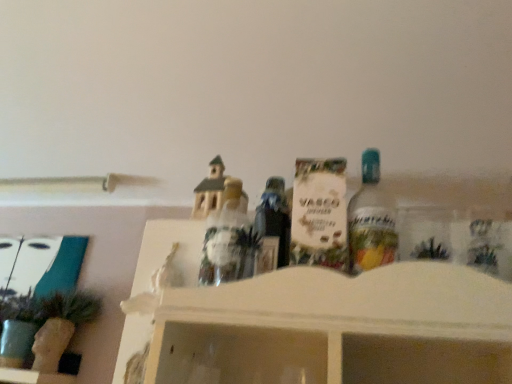
Question: Can you confirm if white matte box at center, placed as the third toy when sorted from left to right, is positioned to the right of matte brown house at center, the second toy positioned from the left?

Choices:
 (A) yes
 (B) no

Answer: (A)

Question: Is white matte box at center, placed as the third toy when sorted from left to right, with matte brown house at center, the 2th toy positioned from the right?

Choices:
 (A) yes
 (B) no

Answer: (B)

Question: Can you confirm if white matte box at center, arranged as the first toy when viewed from the right, is wider than matte brown house at center, the second toy positioned from the left?

Choices:
 (A) no
 (B) yes

Answer: (A)

Question: Can you confirm if white matte box at center, placed as the third toy when sorted from left to right, is bigger than matte brown house at center, the second toy positioned from the left?

Choices:
 (A) no
 (B) yes

Answer: (A)

Question: Is white matte box at center, placed as the third toy when sorted from left to right, facing away from matte brown house at center, the second toy positioned from the left?

Choices:
 (A) no
 (B) yes

Answer: (A)

Question: From the image's perspective, is white matte box at center, arranged as the first toy when viewed from the right, below matte brown house at center, the second toy positioned from the left?

Choices:
 (A) yes
 (B) no

Answer: (B)

Question: From a real-world perspective, is translucent plastic figurine at center, the third toy from the right, located beneath clear glass bottle at center-right?

Choices:
 (A) yes
 (B) no

Answer: (A)

Question: Are translucent plastic figurine at center, the third toy from the right, and clear glass bottle at center-right making contact?

Choices:
 (A) yes
 (B) no

Answer: (B)

Question: Is translucent plastic figurine at center, the third toy from the right, in front of clear glass bottle at center-right?

Choices:
 (A) no
 (B) yes

Answer: (A)

Question: Is translucent plastic figurine at center, the third toy from the right, facing away from clear glass bottle at center-right?

Choices:
 (A) no
 (B) yes

Answer: (A)

Question: From the image's perspective, would you say translucent plastic figurine at center, the third toy from the right, is shown under clear glass bottle at center-right?

Choices:
 (A) yes
 (B) no

Answer: (A)

Question: Is translucent plastic figurine at center, the first toy positioned from the left, positioned beyond the bounds of clear glass bottle at center-right?

Choices:
 (A) no
 (B) yes

Answer: (B)

Question: Is clear glass bottle at center-right surrounding matte brown house at center, the second toy positioned from the left?

Choices:
 (A) yes
 (B) no

Answer: (B)